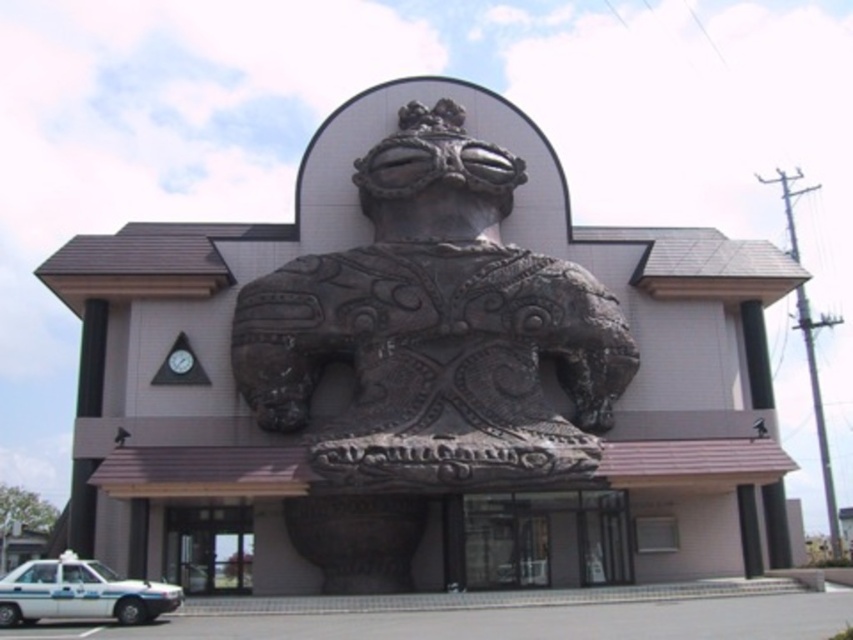
Question: Which point is farther to the camera?

Choices:
 (A) (573, 339)
 (B) (84, 560)

Answer: (A)

Question: Which of the following is the farthest from the observer?

Choices:
 (A) (25, 616)
 (B) (627, 384)

Answer: (B)

Question: Does rustic stone statue at center appear over white glossy taxi at lower left?

Choices:
 (A) no
 (B) yes

Answer: (B)

Question: Does rustic stone statue at center have a larger size compared to white glossy taxi at lower left?

Choices:
 (A) yes
 (B) no

Answer: (B)

Question: Which object is farther from the camera taking this photo?

Choices:
 (A) white glossy taxi at lower left
 (B) rustic stone statue at center

Answer: (B)

Question: Does rustic stone statue at center appear on the left side of white glossy taxi at lower left?

Choices:
 (A) yes
 (B) no

Answer: (B)